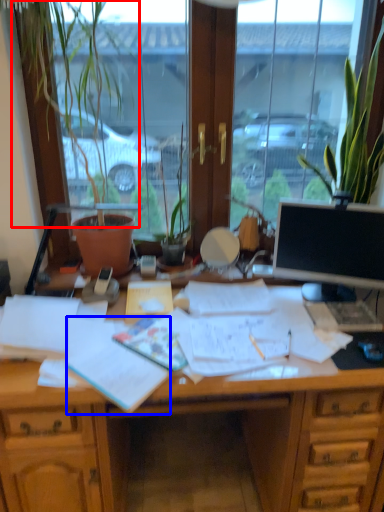
Question: Which object is closer to the camera taking this photo, plant (highlighted by a red box) or document (highlighted by a blue box)?

Choices:
 (A) plant
 (B) document

Answer: (B)